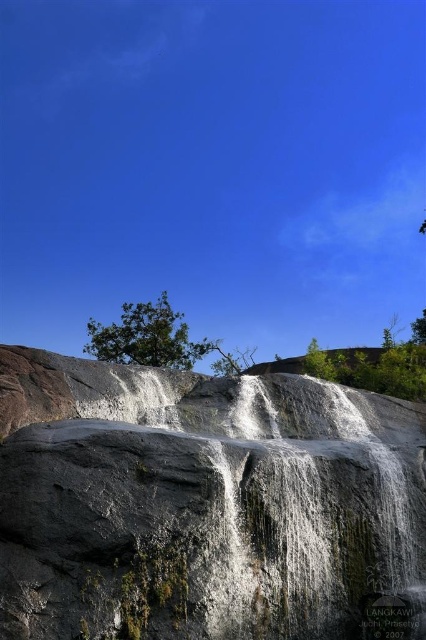
Does gray rough rock face at center have a smaller size compared to green leafy tree at center?

Yes, gray rough rock face at center is smaller than green leafy tree at center.

Between point (100, 582) and point (115, 344), which one is positioned behind?

Positioned behind is point (115, 344).

The image size is (426, 640). I want to click on gray rough rock face at center, so click(x=204, y=504).